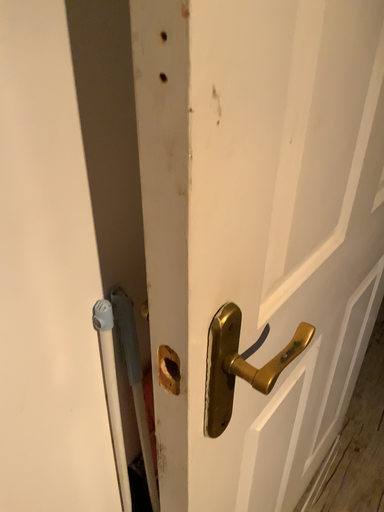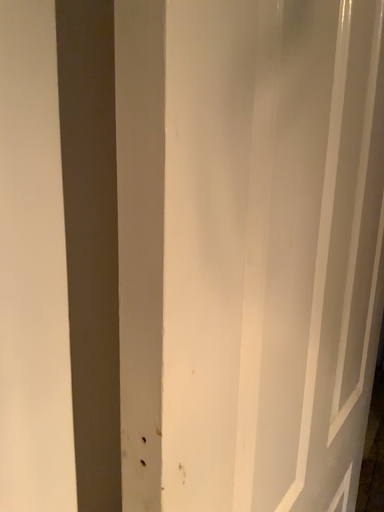
Question: How did the camera likely rotate when shooting the video?

Choices:
 (A) rotated downward
 (B) rotated upward

Answer: (B)